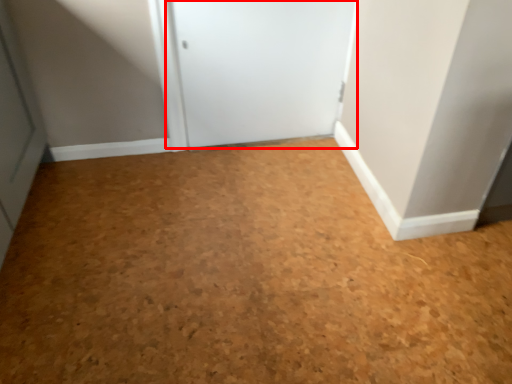
Question: From the image's perspective, considering the relative positions of door (annotated by the red box) and plain in the image provided, where is door (annotated by the red box) located with respect to the staircase?

Choices:
 (A) above
 (B) below

Answer: (A)